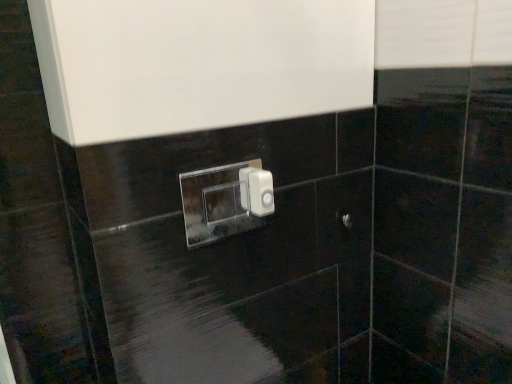
Question: Is point pos(334,213) positioned closer to the camera than point pos(208,170)?

Choices:
 (A) farther
 (B) closer

Answer: (A)

Question: Considering the positions of satin nickel door handle at center and transparent acrylic light switch at center, which is the 2th light switch from right to left, in the image, is satin nickel door handle at center wider or thinner than transparent acrylic light switch at center, which is the 2th light switch from right to left,?

Choices:
 (A) wide
 (B) thin

Answer: (A)

Question: Based on their relative distances, which object is farther from the white plastic light switch at center, which ranks as the 2th light switch in left-to-right order?

Choices:
 (A) satin nickel door handle at center
 (B) transparent acrylic light switch at center, the first light switch in the left-to-right sequence

Answer: (B)

Question: Which object is positioned farthest from the white plastic light switch at center, which ranks as the 2th light switch in left-to-right order?

Choices:
 (A) satin nickel door handle at center
 (B) transparent acrylic light switch at center, the first light switch in the left-to-right sequence

Answer: (B)